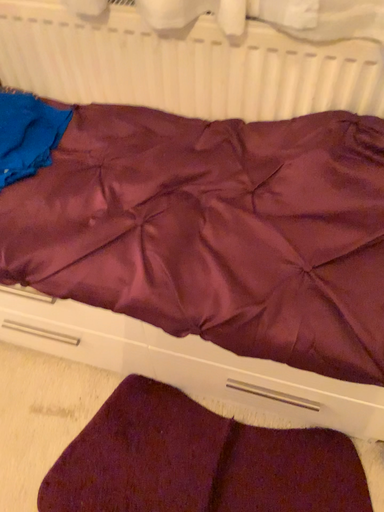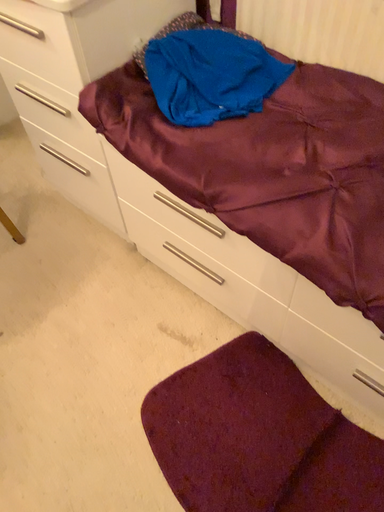
Question: Which way did the camera rotate in the video?

Choices:
 (A) rotated right
 (B) rotated left

Answer: (B)